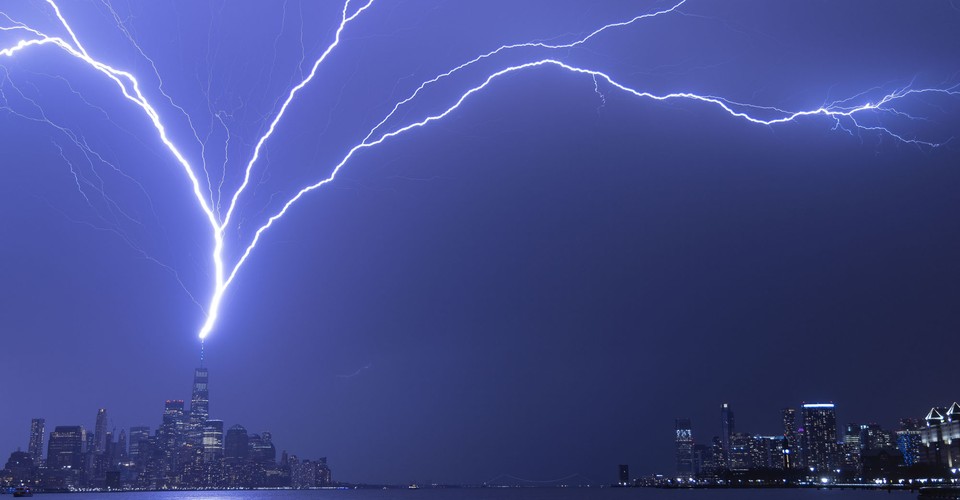
At what (x,y) coordinates should I click in order to perform the action: click on cable. Please return your answer as a coordinate pair (x, y). The image size is (960, 500). Looking at the image, I should click on (524, 476), (476, 482).